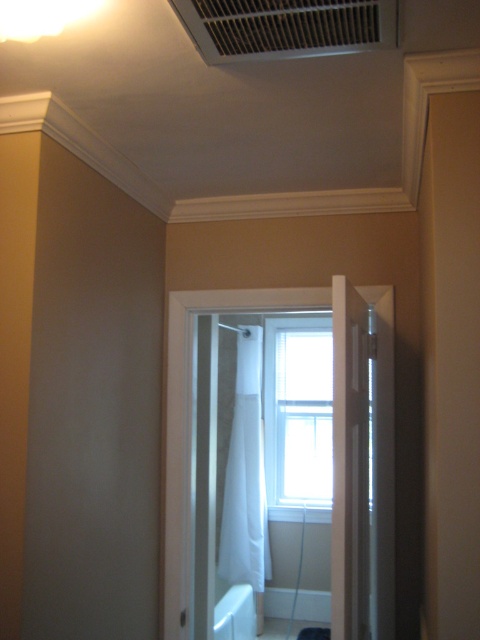
Who is positioned more to the left, white matte bathtub at lower center or white fabric shower curtain at center?

From the viewer's perspective, white fabric shower curtain at center appears more on the left side.

Is white matte bathtub at lower center closer to the viewer compared to white fabric shower curtain at center?

Yes, white matte bathtub at lower center is closer to the viewer.

Image resolution: width=480 pixels, height=640 pixels. Describe the element at coordinates (236, 612) in the screenshot. I see `white matte bathtub at lower center` at that location.

Identify the location of white matte bathtub at lower center. This screenshot has width=480, height=640. (236, 612).

Is white plastic air conditioner at upper center closer to the viewer compared to white matte bathtub at lower center?

Yes, white plastic air conditioner at upper center is in front of white matte bathtub at lower center.

Is white plastic air conditioner at upper center to the right of white matte bathtub at lower center from the viewer's perspective?

Correct, you'll find white plastic air conditioner at upper center to the right of white matte bathtub at lower center.

Is point (201, 36) in front of point (251, 596)?

Yes, point (201, 36) is in front of point (251, 596).

The width and height of the screenshot is (480, 640). I want to click on white plastic air conditioner at upper center, so click(x=287, y=26).

Can you confirm if white plastic air conditioner at upper center is shorter than white sheer fabric at center?

Indeed, white plastic air conditioner at upper center has a lesser height compared to white sheer fabric at center.

Between white plastic air conditioner at upper center and white sheer fabric at center, which one is positioned lower?

white sheer fabric at center is below.

This screenshot has width=480, height=640. Find the location of `white plastic air conditioner at upper center`. white plastic air conditioner at upper center is located at coordinates [287, 26].

Where is `white plastic air conditioner at upper center`? The width and height of the screenshot is (480, 640). white plastic air conditioner at upper center is located at coordinates [287, 26].